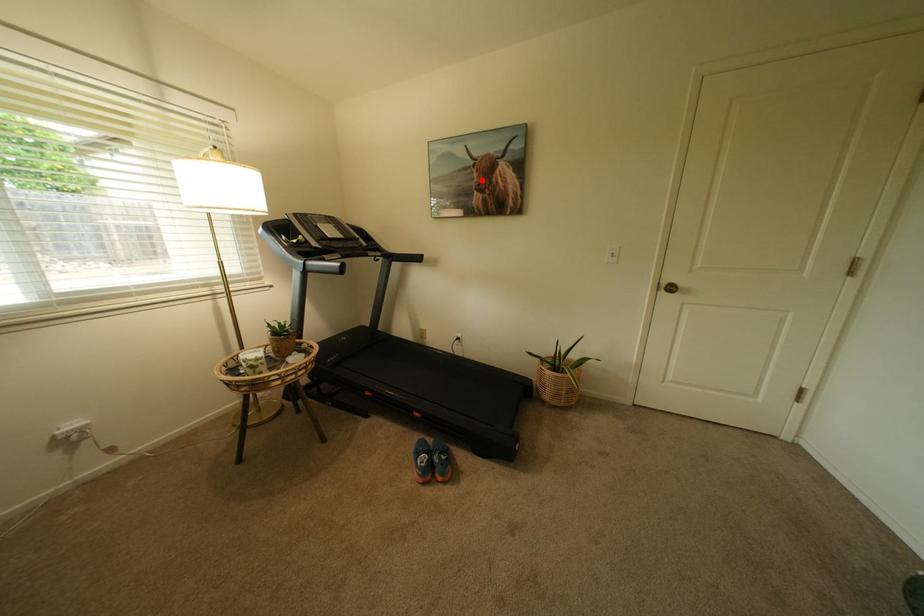
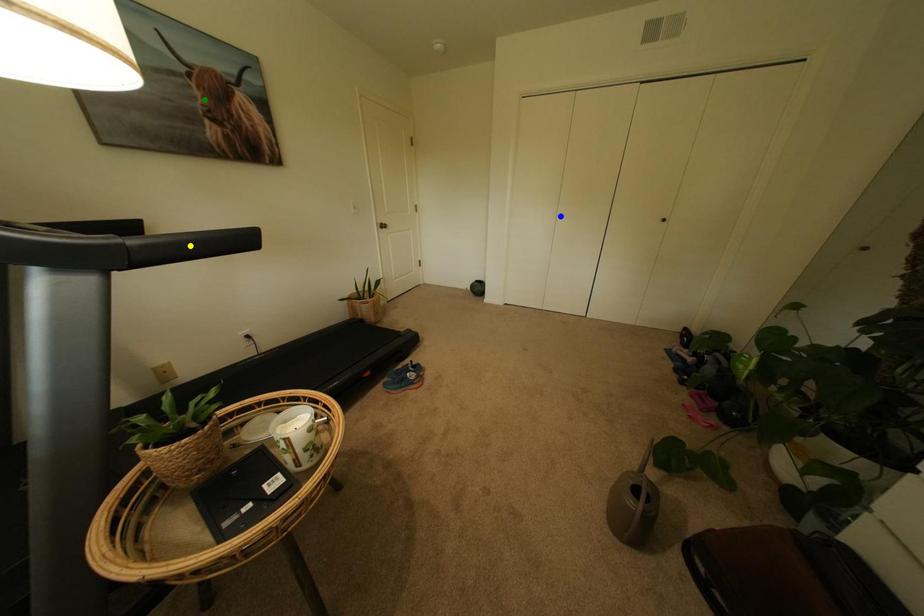
Question: I am providing you with two images of the same scene from different viewpoints. A red point is marked on the first image. You are given multiple points on the second image. In image 2, which mark is for the same physical point as the one in image 1?

Choices:
 (A) yellow point
 (B) green point
 (C) blue point

Answer: (B)